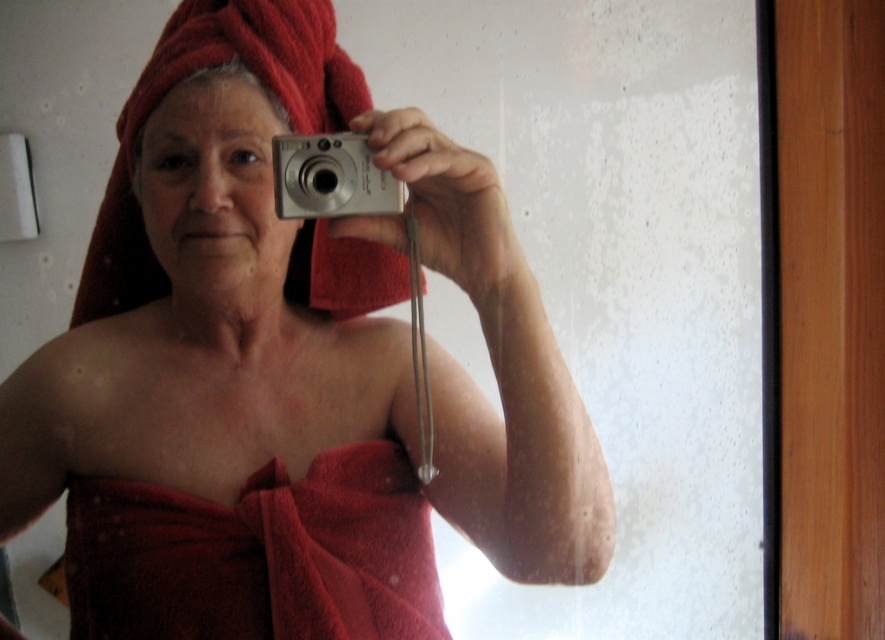
You are standing in a bathroom and see the red towel at center. If you want to grab it without moving your feet, can you reach it?

The red towel at center is 26.12 inches away from the viewer, so yes, you can reach it without moving your feet since it is within arm reach.